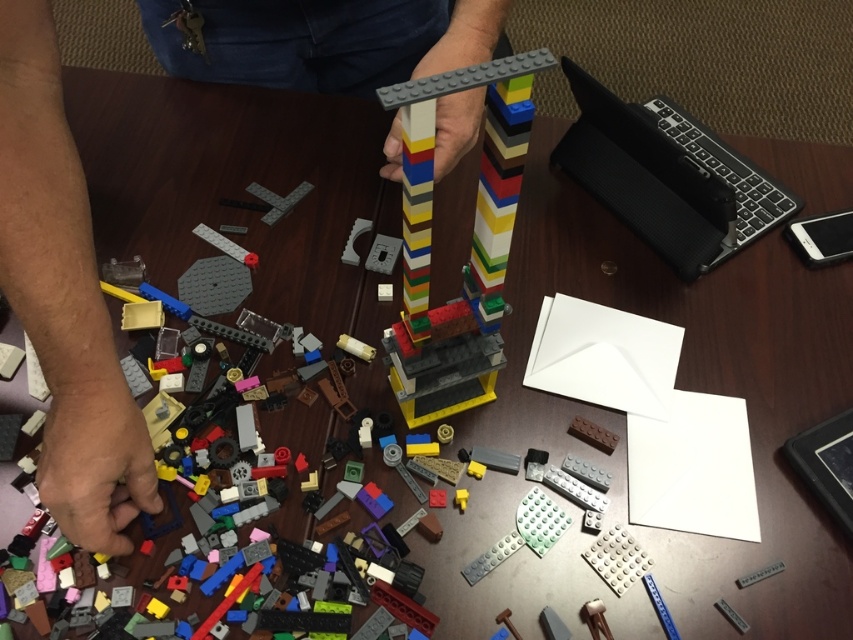
You are trying to reach for the black textured laptop at upper right while your hand is at smooth skin hand at lower left. Can you reach it without moving your hand?

The smooth skin hand at lower left is below the black textured laptop at upper right, so you can reach it without moving your hand as it is positioned lower and the laptop is above.

Looking at this image, you are a photographer setting up a shoot at the wooden table. You need to position a small lamp between the smooth skin hand at lower left and the black textured laptop at upper right. Based on their positions, will the lamp fit horizontally between them?

The smooth skin hand at lower left is to the left of the black textured laptop at upper right, so there is space between them for the lamp to fit horizontally.